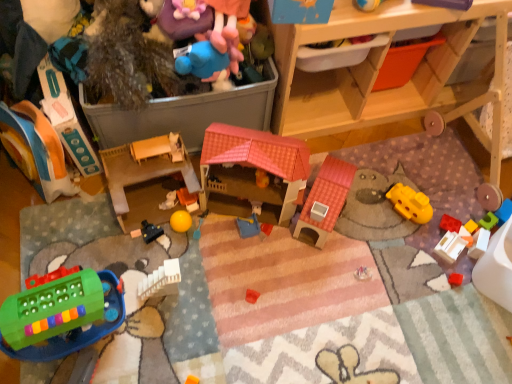
Where is `vacant space behind white matte block at lower right, which is the 12th toy in left-to-right order`? The width and height of the screenshot is (512, 384). vacant space behind white matte block at lower right, which is the 12th toy in left-to-right order is located at coordinates (457, 205).